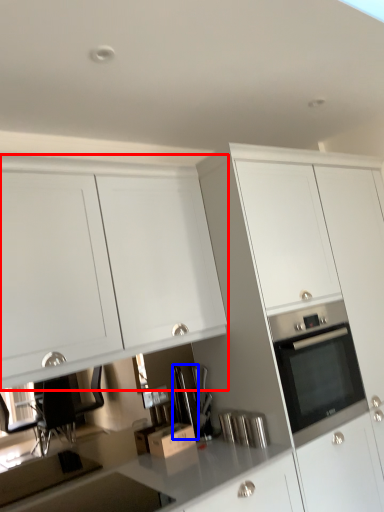
Question: Which of the following is the closest to the observer, cabinetry (highlighted by a red box) or appliance (highlighted by a blue box)?

Choices:
 (A) cabinetry
 (B) appliance

Answer: (A)